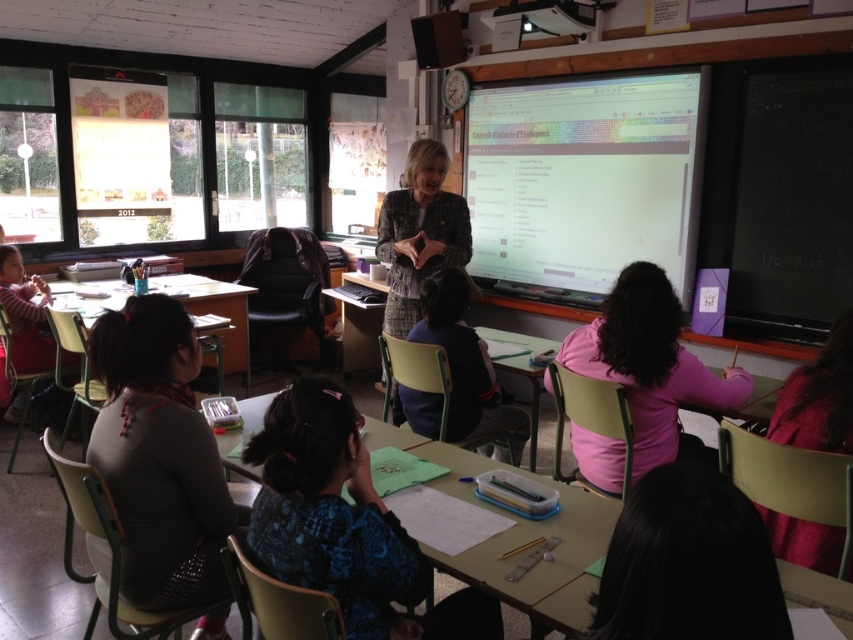
You are a student sitting at the desk in the center of the classroom. You notice two items on your desk. One is the dark gray sweater at center and the other is the patterned fabric jacket at center. Which item is closer to the floor?

The dark gray sweater at center is positioned under the patterned fabric jacket at center, so it is closer to the floor.

You are a teacher standing at the front of the classroom near the chalkboard. You need to collect both the pink matte sweater at center and the patterned fabric jacket at center. Considering your current position, which item will you reach first?

Since the pink matte sweater at center and the patterned fabric jacket at center are both at the center of the classroom, you will reach them at the same time as they are equidistant from your position at the front near the chalkboard.